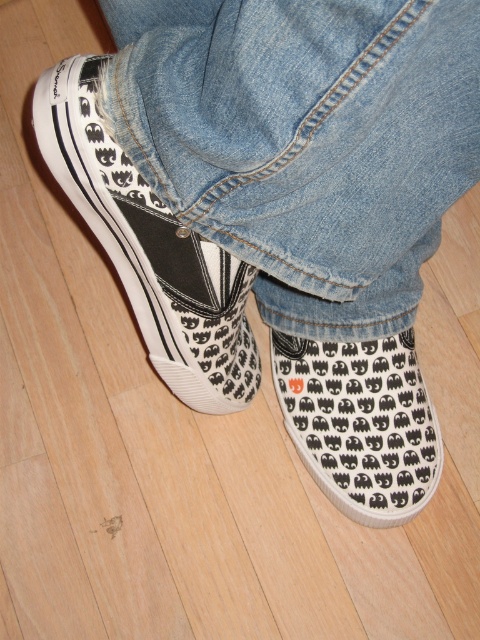
From the picture: Is denim at center to the right of canvas sneakers at lower left from the viewer's perspective?

Correct, you'll find denim at center to the right of canvas sneakers at lower left.

Can you confirm if denim at center is shorter than canvas sneakers at lower left?

Correct, denim at center is not as tall as canvas sneakers at lower left.

Which is behind, point (288, 45) or point (46, 70)?

The point (46, 70) is behind.

Locate an element on the screen. This screenshot has width=480, height=640. denim at center is located at coordinates (304, 140).

Does canvas sneakers at lower left lie in front of white canvas slip-on at lower center?

Yes, it is in front of white canvas slip-on at lower center.

What do you see at coordinates (151, 250) in the screenshot? The height and width of the screenshot is (640, 480). I see `canvas sneakers at lower left` at bounding box center [151, 250].

Is point (165, 300) positioned after point (379, 474)?

No.

You are a GUI agent. You are given a task and a screenshot of the screen. Output one action in this format:
    pyautogui.click(x=<x>, y=<y>)
    Task: Click on the canvas sneakers at lower left
    The width and height of the screenshot is (480, 640).
    Given the screenshot: What is the action you would take?
    pyautogui.click(x=151, y=250)

In the scene shown: Which is below, denim at center or white canvas slip-on at lower center?

Positioned lower is white canvas slip-on at lower center.

Who is shorter, denim at center or white canvas slip-on at lower center?

white canvas slip-on at lower center is shorter.

Who is more distant from viewer, (432, 236) or (350, 342)?

Positioned behind is point (350, 342).

This screenshot has height=640, width=480. In order to click on denim at center in this screenshot , I will do `click(304, 140)`.